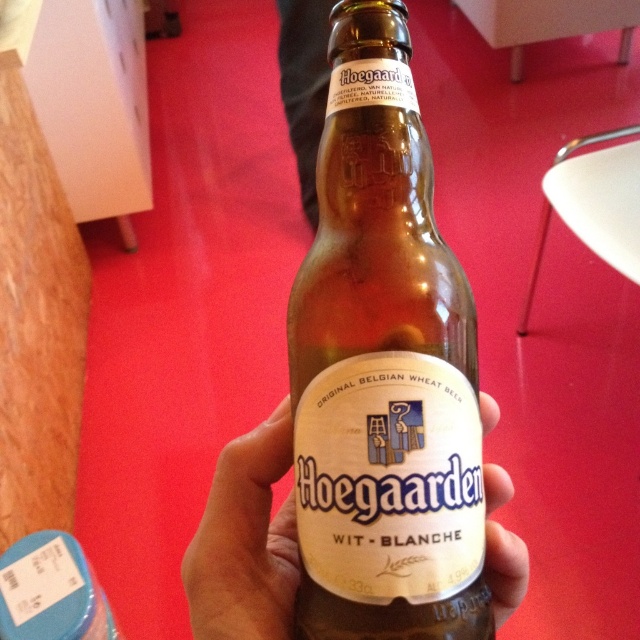
Question: Which of the following is the closest to the observer?

Choices:
 (A) (269, 461)
 (B) (369, 220)

Answer: (B)

Question: Which of the following is the closest to the observer?

Choices:
 (A) brown glass bottle at center
 (B) translucent glass bottle at center

Answer: (A)

Question: Can you confirm if brown glass bottle at center is wider than clear glass bottle at center?

Choices:
 (A) no
 (B) yes

Answer: (A)

Question: Does brown glass bottle at center appear under clear glass bottle at center?

Choices:
 (A) no
 (B) yes

Answer: (A)

Question: Which of the following is the closest to the observer?

Choices:
 (A) (56, 538)
 (B) (280, 566)

Answer: (B)

Question: Does brown glass bottle at center appear under translucent glass bottle at center?

Choices:
 (A) no
 (B) yes

Answer: (A)